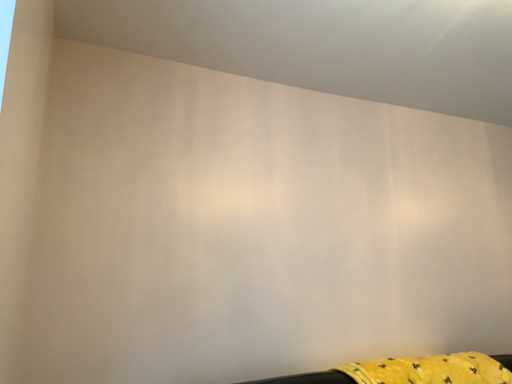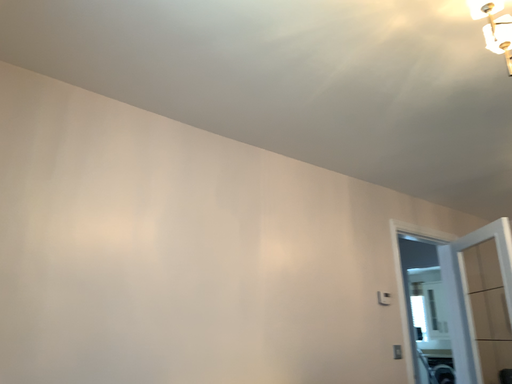
Question: How did the camera likely rotate when shooting the video?

Choices:
 (A) rotated right
 (B) rotated left

Answer: (A)